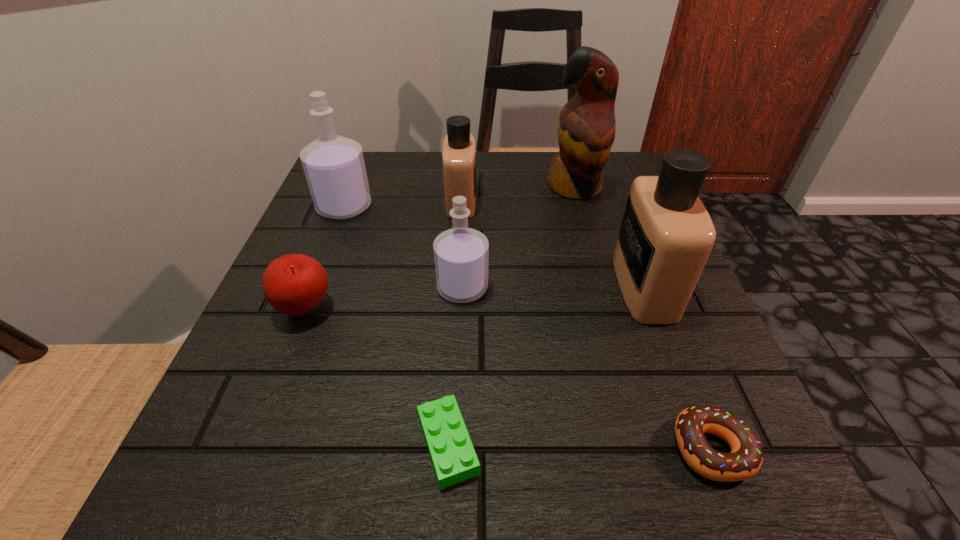
Where is `vacant space that's between the Lego and the apple`? This screenshot has width=960, height=540. vacant space that's between the Lego and the apple is located at coordinates point(376,376).

Locate an element on the screen. object identified as the closest to the nearer beige perfume is located at coordinates (745, 460).

Select which object appears as the third closest to the red parrot. Please provide its 2D coordinates. Your answer should be formatted as a tuple, i.e. [(x, y)], where the tuple contains the x and y coordinates of a point satisfying the conditions above.

[(461, 254)]

Where is `the third closest perfume to the red parrot`? Image resolution: width=960 pixels, height=540 pixels. the third closest perfume to the red parrot is located at coordinates (461, 254).

Identify which perfume is the closest to the red apple. Please provide its 2D coordinates. Your answer should be formatted as a tuple, i.e. [(x, y)], where the tuple contains the x and y coordinates of a point satisfying the conditions above.

[(461, 254)]

You are a GUI agent. You are given a task and a screenshot of the screen. Output one action in this format:
    pyautogui.click(x=<x>, y=<y>)
    Task: Click on the blank space that satisfies the following two spatial constraints: 1. on the front label of the bigger beige perfume; 2. on the right side of the seventh tallest object
    
    Given the screenshot: What is the action you would take?
    pyautogui.click(x=707, y=448)

This screenshot has width=960, height=540. Find the location of `free space that satisfies the following two spatial constraints: 1. on the front label of the smaller beige perfume; 2. on the front side of the leftmost perfume`. free space that satisfies the following two spatial constraints: 1. on the front label of the smaller beige perfume; 2. on the front side of the leftmost perfume is located at coordinates (461, 207).

This screenshot has width=960, height=540. Identify the location of free spot that satisfies the following two spatial constraints: 1. on the front label of the shortest object; 2. on the left side of the farther beige perfume. (447, 444).

What are the coordinates of `free point that satisfies the following two spatial constraints: 1. on the back side of the Lego; 2. on the front label of the smaller beige perfume` in the screenshot? It's located at (462, 201).